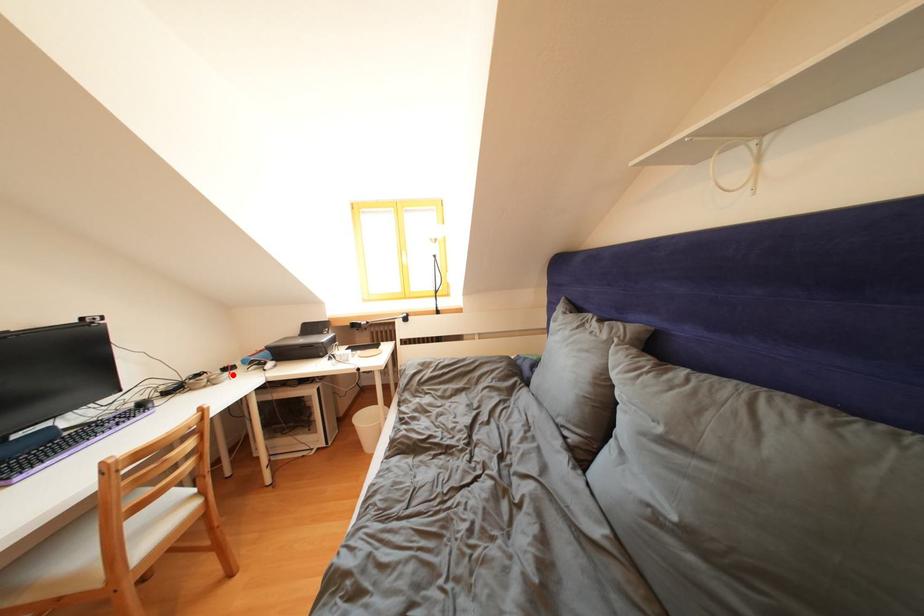
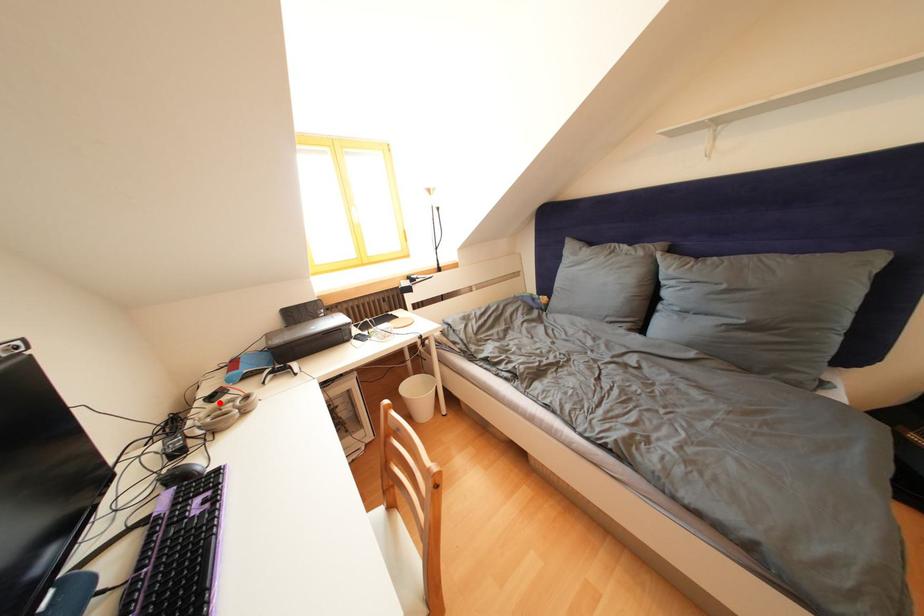
I am providing you with two images of the same scene from different viewpoints. A red point is marked on the first image and another point is marked on the second image. Is the red point in image1 aligned with the point shown in image2?

Yes